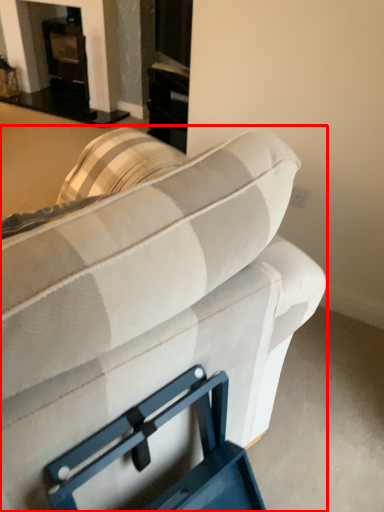
Question: Where is studio couch (annotated by the red box) located in relation to fireplace in the image?

Choices:
 (A) left
 (B) right

Answer: (B)